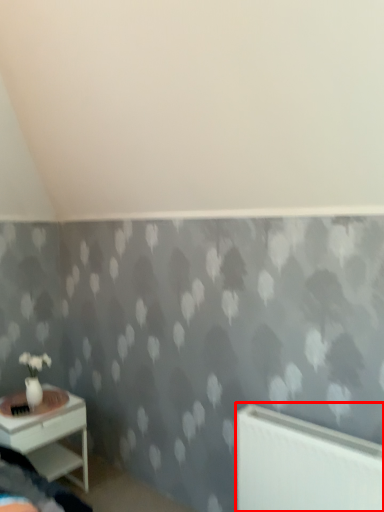
Question: Observing the image, what is the correct spatial positioning of radiator (annotated by the red box) in reference to nightstand?

Choices:
 (A) left
 (B) right

Answer: (B)